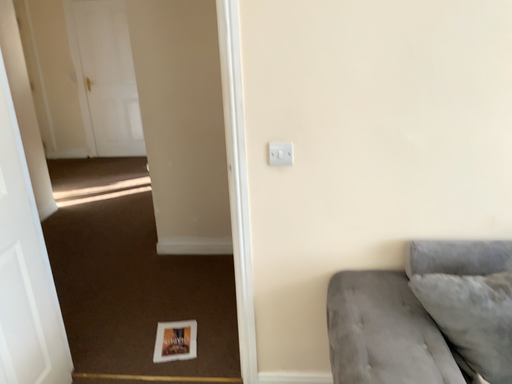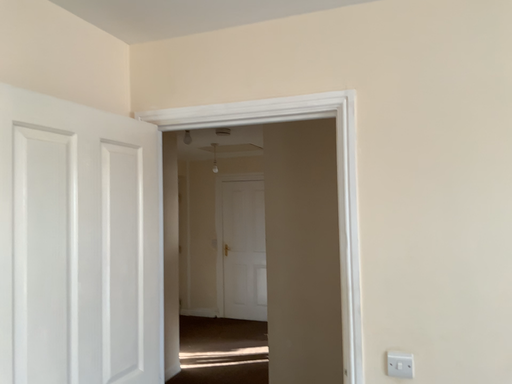
Question: How did the camera likely rotate when shooting the video?

Choices:
 (A) rotated upward
 (B) rotated downward

Answer: (A)